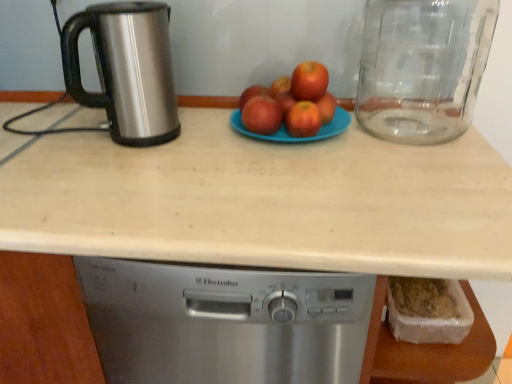
Where is `vacant space in front of transparent glass jar at right`? Image resolution: width=512 pixels, height=384 pixels. vacant space in front of transparent glass jar at right is located at coordinates [436, 166].